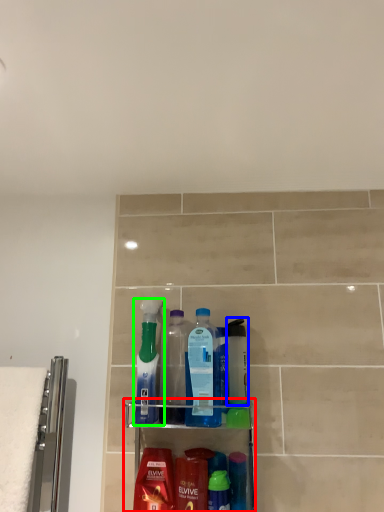
Question: Estimate the real-world distances between objects in this image. Which object is closer to shelf (highlighted by a red box), mouthwash (highlighted by a blue box) or bottle (highlighted by a green box)?

Choices:
 (A) mouthwash
 (B) bottle

Answer: (A)